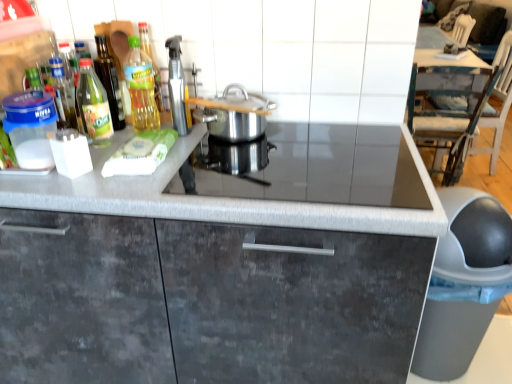
The image size is (512, 384). Find the location of `vacant area that is in front of silver metallic spray bottle at upper center, placed as the 3th kitchen appliance when sorted from left to right`. vacant area that is in front of silver metallic spray bottle at upper center, placed as the 3th kitchen appliance when sorted from left to right is located at coordinates (x=192, y=154).